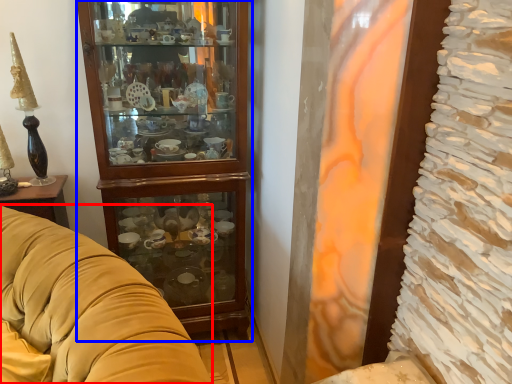
Question: Which point is further to the camera, studio couch (highlighted by a red box) or cabinetry (highlighted by a blue box)?

Choices:
 (A) studio couch
 (B) cabinetry

Answer: (B)